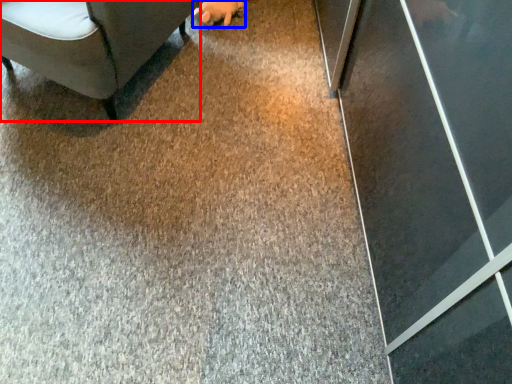
Question: Which object is closer to the camera taking this photo, furniture (highlighted by a red box) or hand (highlighted by a blue box)?

Choices:
 (A) furniture
 (B) hand

Answer: (A)